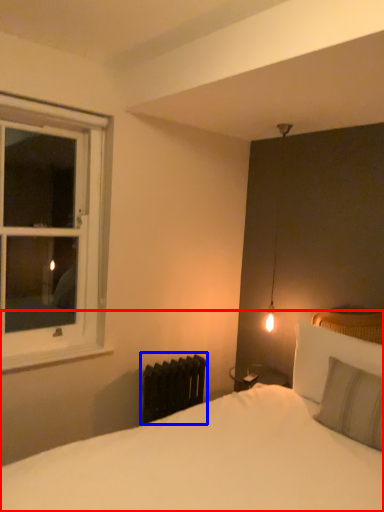
Question: Which point is further to the camera, bed (highlighted by a red box) or radiator (highlighted by a blue box)?

Choices:
 (A) bed
 (B) radiator

Answer: (B)